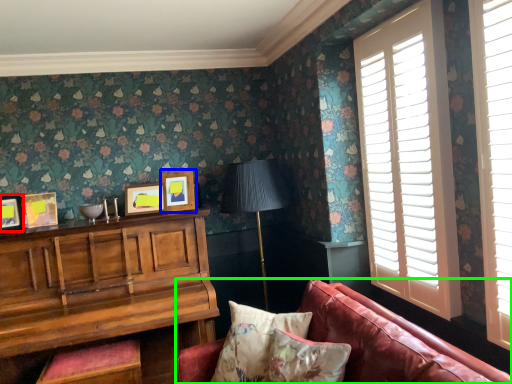
Question: Considering the real-world distances, which object is farthest from picture frame (highlighted by a red box)? picture frame (highlighted by a blue box) or studio couch (highlighted by a green box)?

Choices:
 (A) picture frame
 (B) studio couch

Answer: (B)